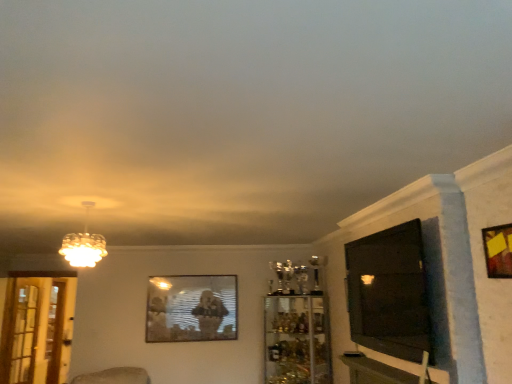
Question: Does clear glass screen door at left, which appears as the second screen door when viewed from the left, have a lesser width compared to black glossy tv at right?

Choices:
 (A) no
 (B) yes

Answer: (B)

Question: Does clear glass screen door at left, positioned as the 1th screen door in right-to-left order, have a larger size compared to black glossy tv at right?

Choices:
 (A) no
 (B) yes

Answer: (A)

Question: Could you tell me if clear glass screen door at left, which is counted as the 1th screen door, starting from the front, is facing black glossy tv at right?

Choices:
 (A) yes
 (B) no

Answer: (B)

Question: Is the depth of clear glass screen door at left, acting as the second screen door starting from the back, less than that of black glossy tv at right?

Choices:
 (A) yes
 (B) no

Answer: (B)

Question: Is black glossy tv at right completely or partially inside clear glass screen door at left, which appears as the second screen door when viewed from the left?

Choices:
 (A) no
 (B) yes

Answer: (A)

Question: Is point (99, 248) positioned closer to the camera than point (207, 322)?

Choices:
 (A) farther
 (B) closer

Answer: (B)

Question: Is matte glass chandelier at upper left inside or outside of metallic reflective frame at center, the second picture frame positioned from the top?

Choices:
 (A) outside
 (B) inside

Answer: (A)

Question: From a real-world perspective, is matte glass chandelier at upper left above or below metallic reflective frame at center, which is counted as the 1th picture frame, starting from the bottom?

Choices:
 (A) below
 (B) above

Answer: (B)

Question: Is matte glass chandelier at upper left taller or shorter than metallic reflective frame at center, marked as the 2th picture frame in a right-to-left arrangement?

Choices:
 (A) short
 (B) tall

Answer: (A)

Question: Is wooden frame at upper right, arranged as the second picture frame when viewed from the back, situated inside metallic reflective frame at center, placed as the 2th picture frame when sorted from front to back, or outside?

Choices:
 (A) outside
 (B) inside

Answer: (A)

Question: From their relative heights in the image, would you say wooden frame at upper right, which is counted as the second picture frame, starting from the left, is taller or shorter than metallic reflective frame at center, the 1th picture frame viewed from the back?

Choices:
 (A) tall
 (B) short

Answer: (B)

Question: Is wooden frame at upper right, the second picture frame in the bottom-to-top sequence, wider or thinner than metallic reflective frame at center, the second picture frame positioned from the top?

Choices:
 (A) thin
 (B) wide

Answer: (A)

Question: From a real-world perspective, is wooden frame at upper right, the first picture frame from the top, above or below metallic reflective frame at center, placed as the 2th picture frame when sorted from front to back?

Choices:
 (A) above
 (B) below

Answer: (A)

Question: From a real-world perspective, is clear glass cabinet at center physically located above or below wooden table at lower right?

Choices:
 (A) above
 (B) below

Answer: (B)

Question: Is clear glass cabinet at center wider or thinner than wooden table at lower right?

Choices:
 (A) thin
 (B) wide

Answer: (B)